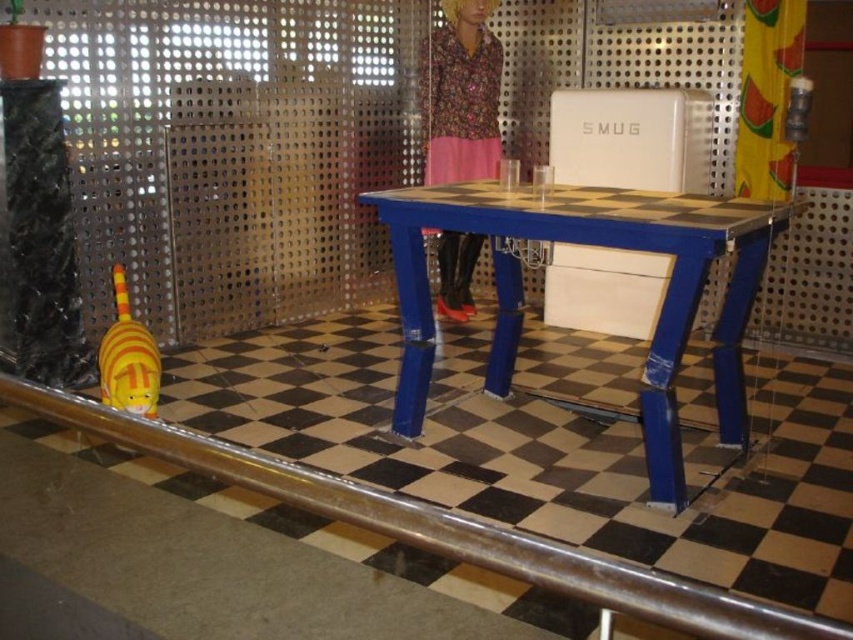
The image size is (853, 640). What do you see at coordinates (41, 237) in the screenshot? I see `black fabric at left` at bounding box center [41, 237].

Which of these two, black fabric at left or floral fabric doll at center, stands shorter?

With less height is floral fabric doll at center.

Which is behind, point (50, 378) or point (447, 291)?

Positioned behind is point (447, 291).

In order to click on black fabric at left in this screenshot , I will do `click(41, 237)`.

Who is lower down, blue painted wood table at center or floral fabric doll at center?

blue painted wood table at center

Is point (721, 236) closer to viewer compared to point (445, 310)?

That is True.

Find the location of a particular element. This screenshot has width=853, height=640. blue painted wood table at center is located at coordinates (592, 244).

Measure the distance between blue painted wood table at center and yellow striped plush at lower left.

5.05 feet

Between point (462, 188) and point (103, 392), which one is positioned in front?

Point (103, 392)

At what (x,y) coordinates should I click in order to perform the action: click on blue painted wood table at center. Please return your answer as a coordinate pair (x, y). The image size is (853, 640). Looking at the image, I should click on (592, 244).